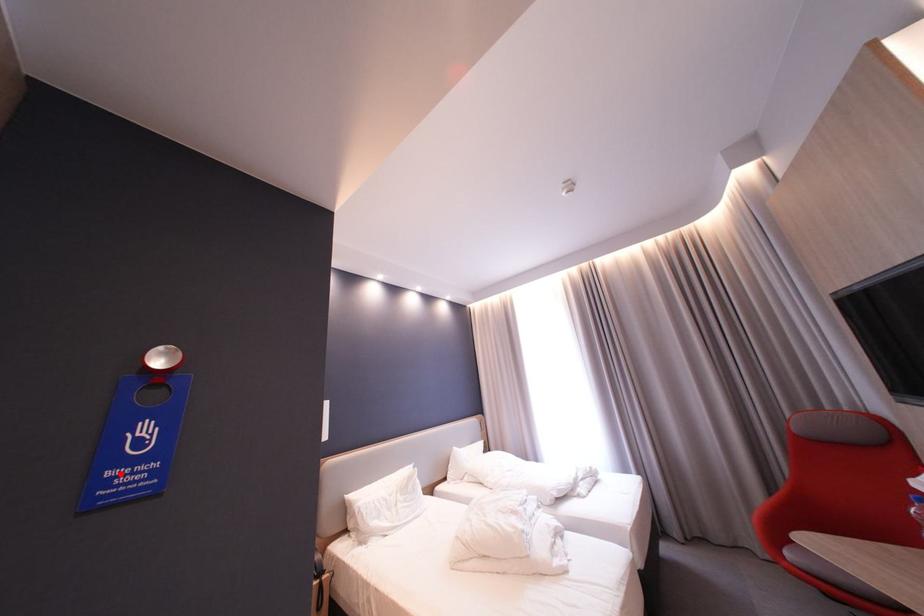
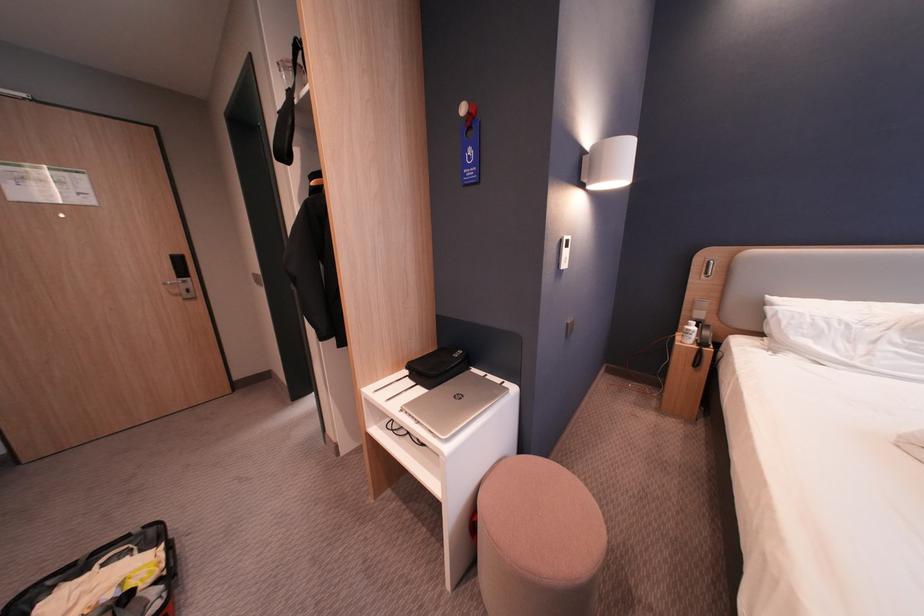
In the second image, find the point that corresponds to the highlighted location in the first image.

(477, 172)